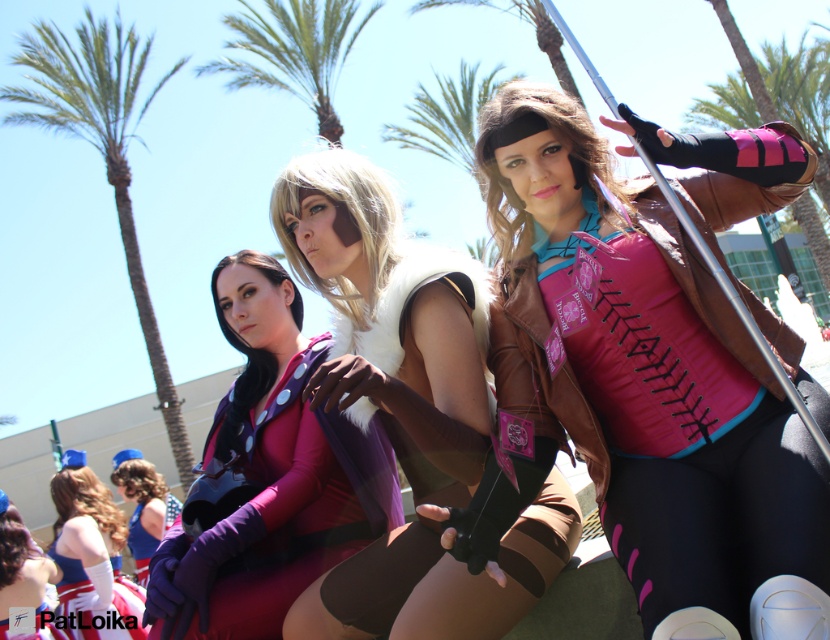
Between shiny blue fabric dress at lower left and matte purple dress at lower left, which one is positioned lower?

shiny blue fabric dress at lower left is lower down.

Which of these two, shiny blue fabric dress at lower left or matte purple dress at lower left, stands shorter?

With less height is matte purple dress at lower left.

Find the location of `shiny blue fabric dress at lower left`. shiny blue fabric dress at lower left is located at coordinates (91, 557).

Does matte purple bodysuit at center appear on the right side of shiny blue fabric dress at lower left?

Indeed, matte purple bodysuit at center is positioned on the right side of shiny blue fabric dress at lower left.

Identify the location of matte purple bodysuit at center. The width and height of the screenshot is (830, 640). 271,474.

Locate an element on the screen. This screenshot has height=640, width=830. matte purple bodysuit at center is located at coordinates (271, 474).

Which is above, green leafy palm tree at upper left or shiny metallic vest at center?

Positioned higher is green leafy palm tree at upper left.

Is green leafy palm tree at upper left wider than shiny metallic vest at center?

Yes, green leafy palm tree at upper left is wider than shiny metallic vest at center.

What do you see at coordinates (101, 150) in the screenshot? The width and height of the screenshot is (830, 640). I see `green leafy palm tree at upper left` at bounding box center [101, 150].

Where is `green leafy palm tree at upper left`? The image size is (830, 640). green leafy palm tree at upper left is located at coordinates (101, 150).